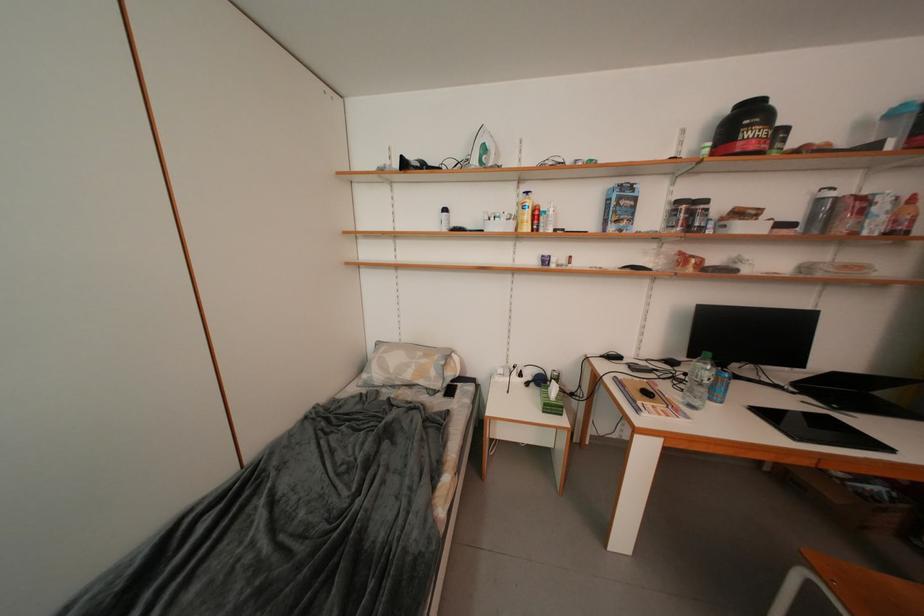
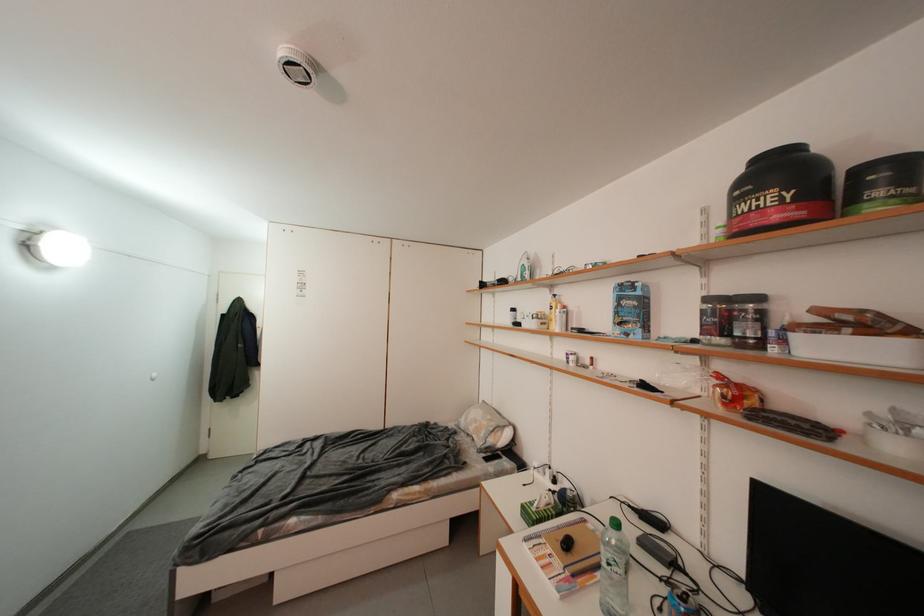
Find the pixel in the second image that matches (x=771, y=135) in the first image.

(776, 201)